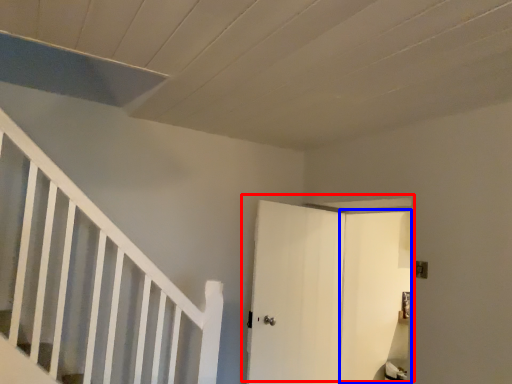
Question: Among these objects, which one is nearest to the camera, door (highlighted by a red box) or door (highlighted by a blue box)?

Choices:
 (A) door
 (B) door

Answer: (B)